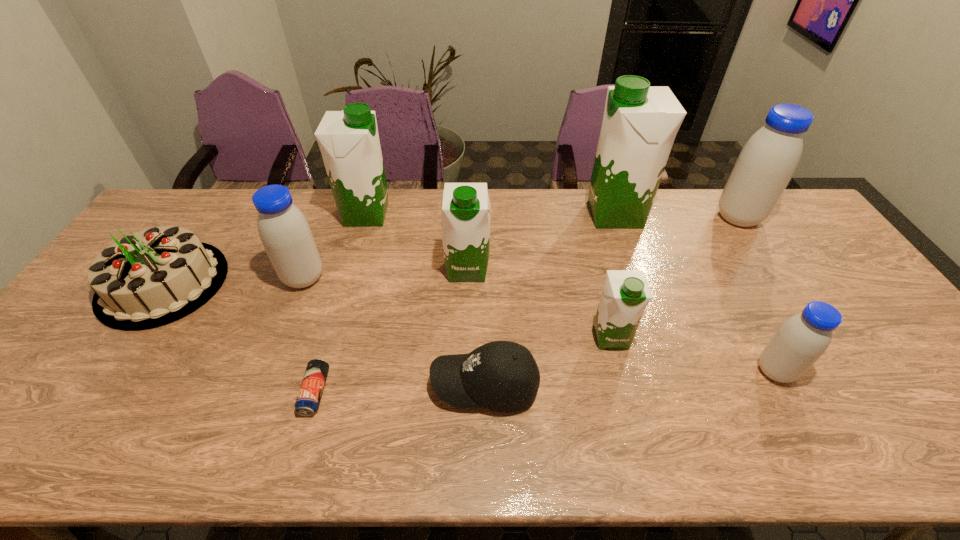
The height and width of the screenshot is (540, 960). I want to click on vacant region located on the front-facing side of the biggest green soya milk, so click(x=517, y=214).

Where is `vacant space located 0.110m on the front-facing side of the biggest green soya milk`? The image size is (960, 540). vacant space located 0.110m on the front-facing side of the biggest green soya milk is located at coordinates (553, 214).

Where is `free space located 0.070m on the front-facing side of the leftmost green soya milk`? This screenshot has height=540, width=960. free space located 0.070m on the front-facing side of the leftmost green soya milk is located at coordinates (412, 214).

I want to click on free space located on the front of the rightmost soya milk, so click(x=812, y=332).

The width and height of the screenshot is (960, 540). I want to click on vacant area situated 0.090m on the front-facing side of the third biggest green soya milk, so click(x=467, y=310).

Identify the location of vacant region located 0.220m on the back of the second smallest blue soya milk. Image resolution: width=960 pixels, height=540 pixels. (326, 218).

Image resolution: width=960 pixels, height=540 pixels. In order to click on blank space located 0.210m on the front of the birthday cake in this screenshot , I will do `click(81, 404)`.

I want to click on blank space located on the back of the nearest blue soya milk, so click(x=753, y=329).

Where is `free region located 0.260m on the front-facing side of the smallest green soya milk`? free region located 0.260m on the front-facing side of the smallest green soya milk is located at coordinates (641, 456).

The height and width of the screenshot is (540, 960). Identify the location of vacant space situated 0.240m on the front-facing side of the ninth tallest object. (330, 385).